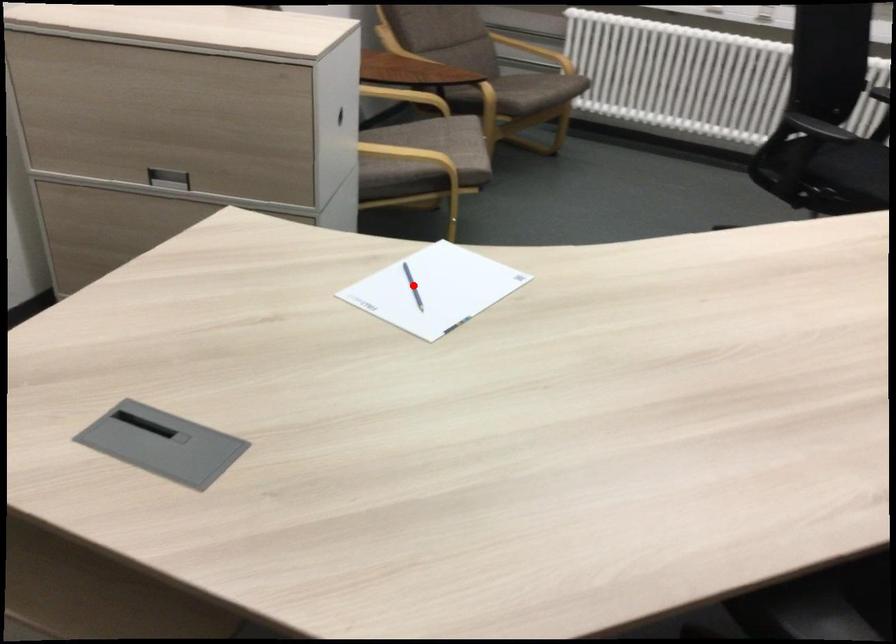
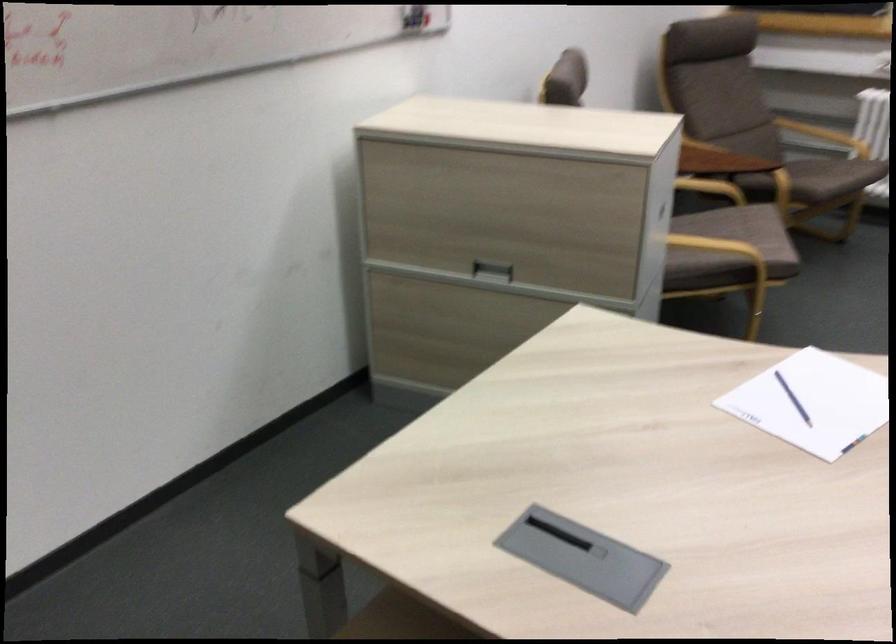
In the second image, find the point that corresponds to the highlighted location in the first image.

(793, 399)